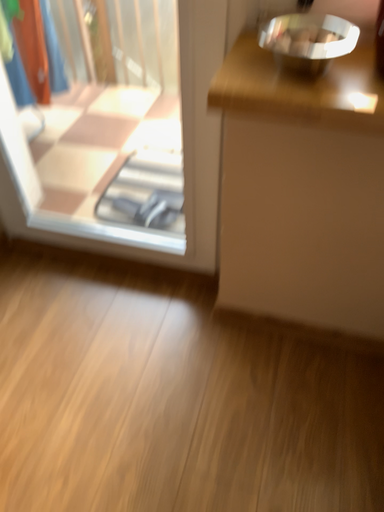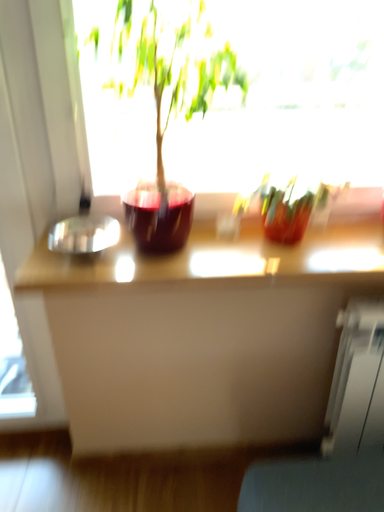
Question: How did the camera likely rotate when shooting the video?

Choices:
 (A) rotated upward
 (B) rotated downward

Answer: (A)